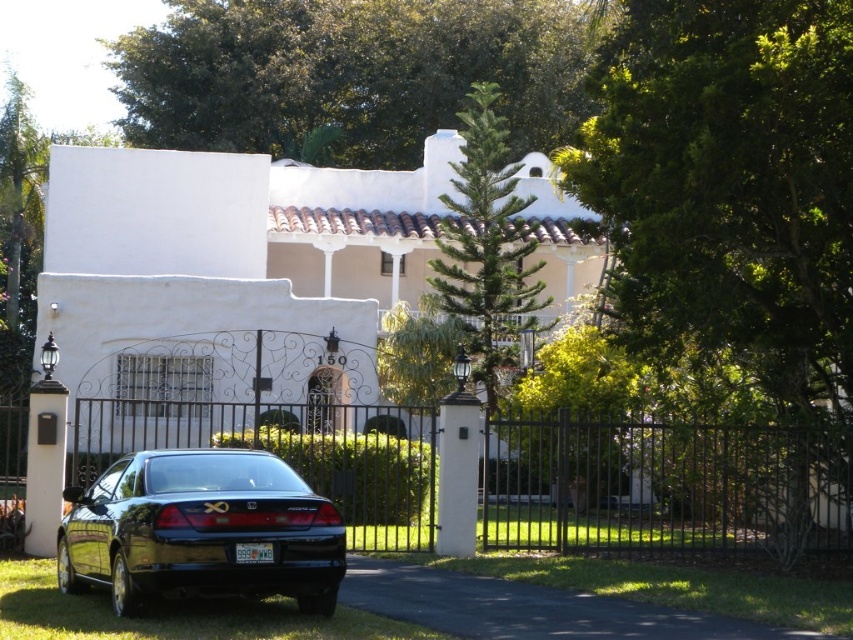
Question: Among these objects, which one is farthest from the camera?

Choices:
 (A) black metal fence at center
 (B) white stucco villa at center
 (C) glossy black sedan at lower left
 (D) black asphalt driveway at center

Answer: (B)

Question: Is white stucco villa at center below black metal fence at center?

Choices:
 (A) yes
 (B) no

Answer: (B)

Question: Is glossy black sedan at lower left below black asphalt driveway at center?

Choices:
 (A) yes
 (B) no

Answer: (B)

Question: Is white stucco villa at center smaller than black asphalt driveway at center?

Choices:
 (A) no
 (B) yes

Answer: (A)

Question: Which of the following is the closest to the observer?

Choices:
 (A) white stucco villa at center
 (B) black metal fence at center

Answer: (B)

Question: Which object appears farthest from the camera in this image?

Choices:
 (A) glossy black sedan at lower left
 (B) black asphalt driveway at center

Answer: (B)